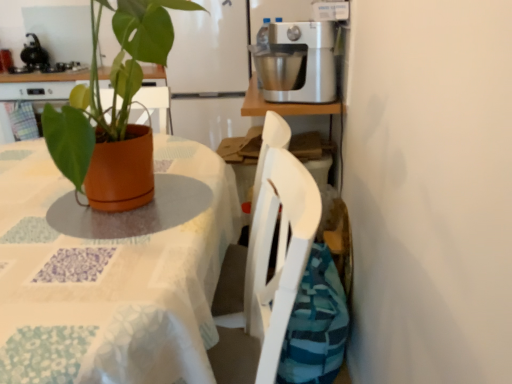
This screenshot has width=512, height=384. In order to click on vacant space that is to the left of terracotta pot at center in this screenshot , I will do `click(30, 200)`.